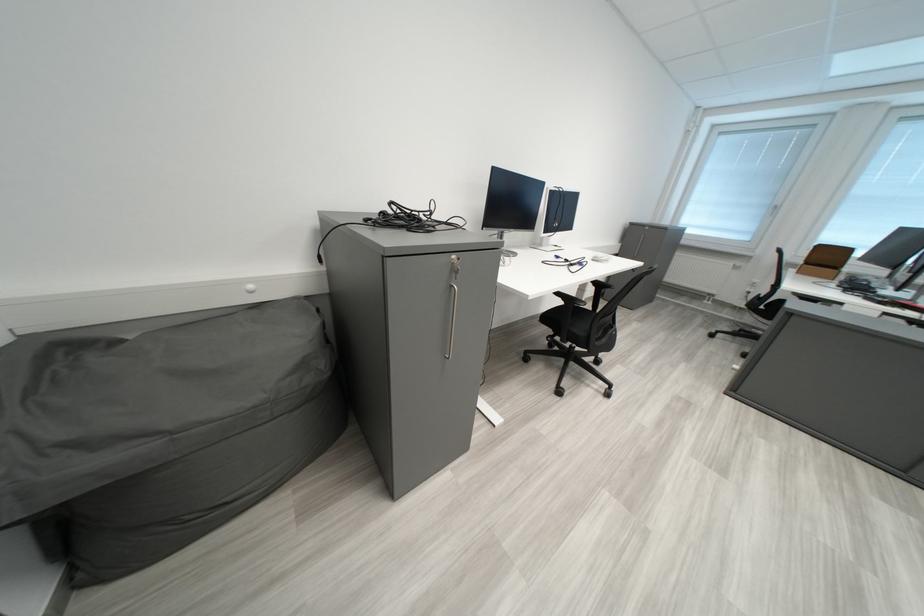
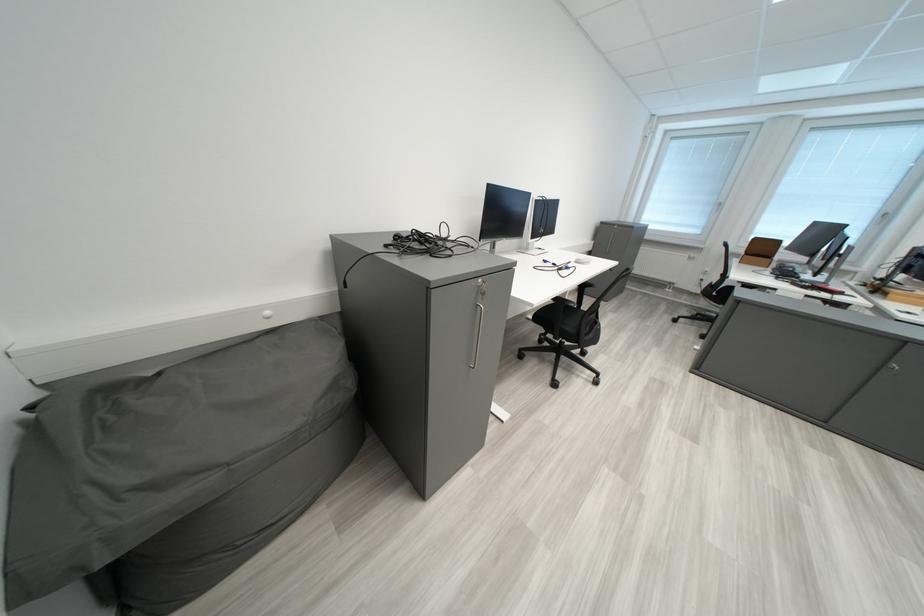
Find the pixel in the second image that matches the point at 833,249 in the first image.

(769, 241)